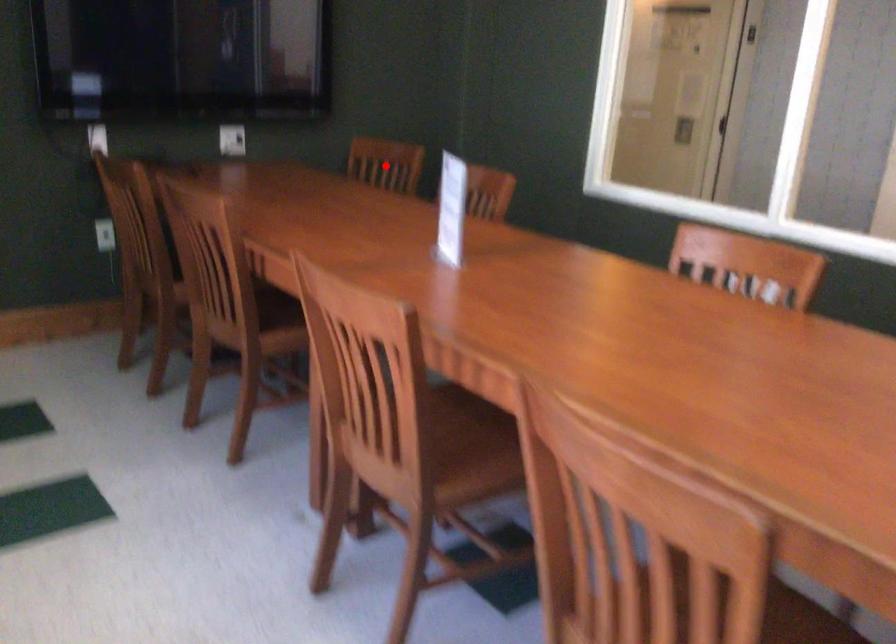
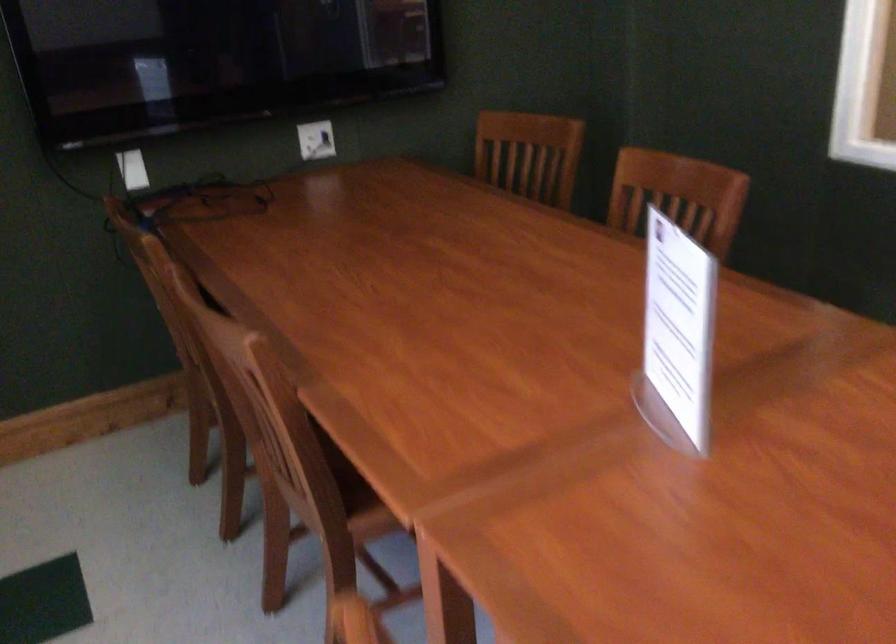
Question: I am providing you with two images of the same scene from different viewpoints. In image1, a red point is highlighted. Considering the same 3D point in image2, which of the following is correct?

Choices:
 (A) It is closer
 (B) It is farther

Answer: (A)